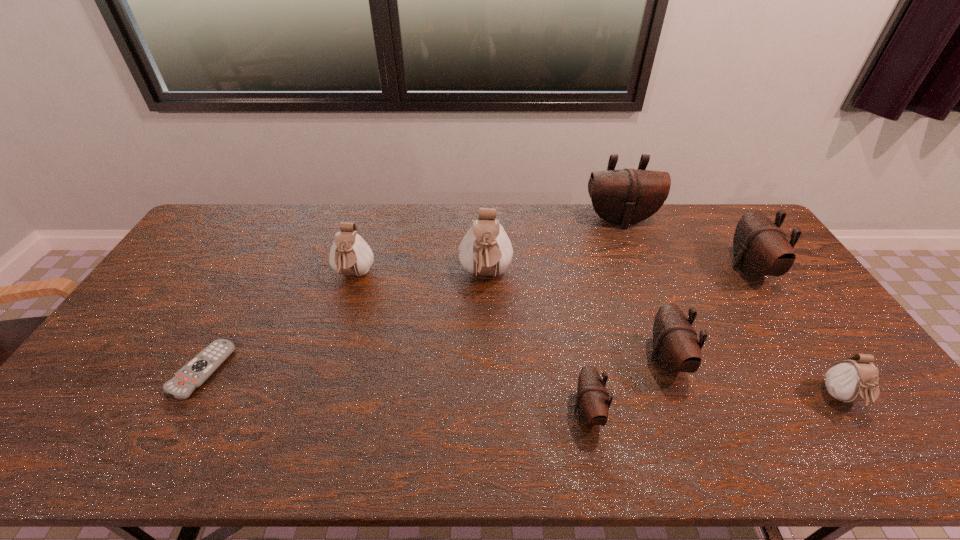
Where is `vacant space located 0.070m on the front-facing side of the leftmost pouch`? This screenshot has width=960, height=540. vacant space located 0.070m on the front-facing side of the leftmost pouch is located at coordinates (344, 310).

Identify the location of vacant region located 0.330m with the flap open on the third biggest brown pouch. (527, 360).

Image resolution: width=960 pixels, height=540 pixels. Identify the location of free location located 0.340m with the flap open on the third biggest brown pouch. (523, 360).

I want to click on blank area located with the flap open on the third biggest brown pouch, so (x=527, y=360).

In order to click on vacant region located with the flap open on the smallest brown pouch in this screenshot , I will do `click(429, 411)`.

Where is `vacant space positioned with the flap open on the smallest brown pouch`? This screenshot has height=540, width=960. vacant space positioned with the flap open on the smallest brown pouch is located at coordinates (462, 411).

You are a GUI agent. You are given a task and a screenshot of the screen. Output one action in this format:
    pyautogui.click(x=<x>, y=<y>)
    Task: Click on the free space located with the flap open on the smallest brown pouch
    The image size is (960, 540).
    Given the screenshot: What is the action you would take?
    pyautogui.click(x=462, y=411)

Where is `free spot located on the back of the shortest object`? This screenshot has height=540, width=960. free spot located on the back of the shortest object is located at coordinates coord(267,251).

The image size is (960, 540). I want to click on object situated at the far edge, so click(x=624, y=197).

Locate an element on the screen. This screenshot has height=540, width=960. object that is positioned at the near edge is located at coordinates (592, 401).